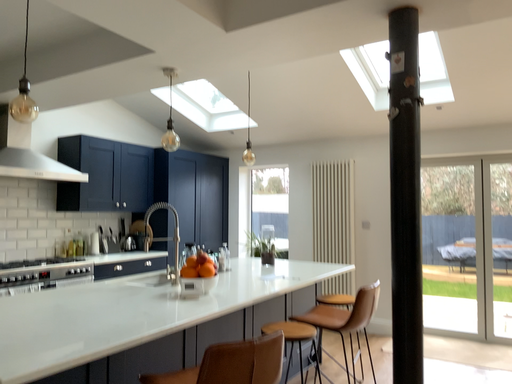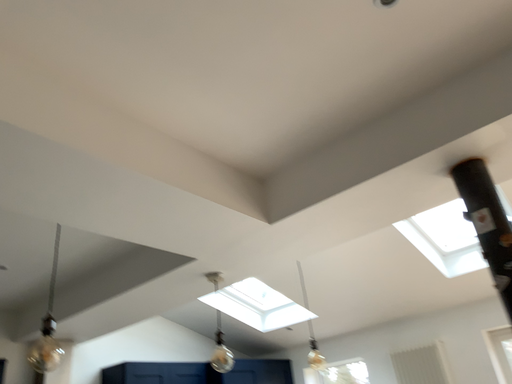
Question: Which way did the camera rotate in the video?

Choices:
 (A) rotated downward
 (B) rotated upward

Answer: (B)